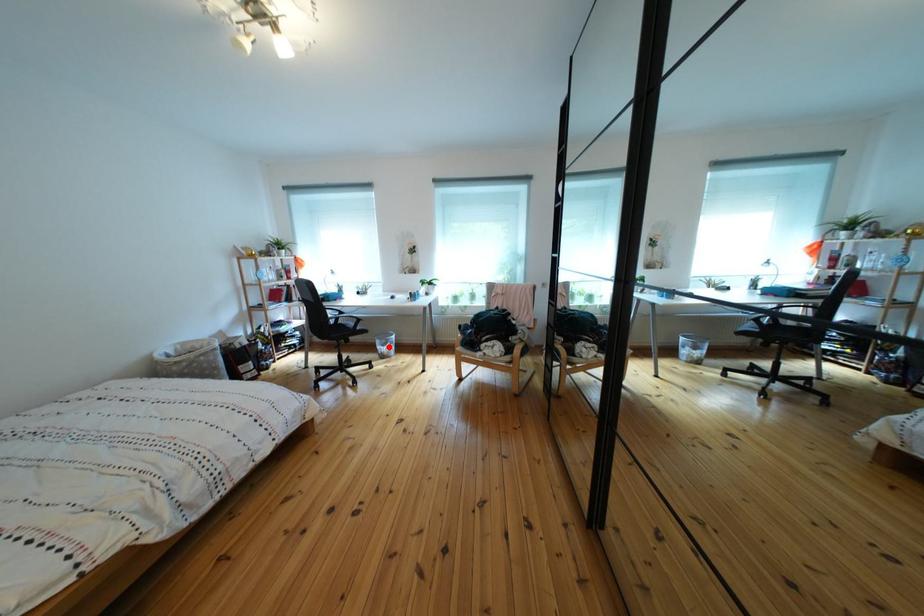
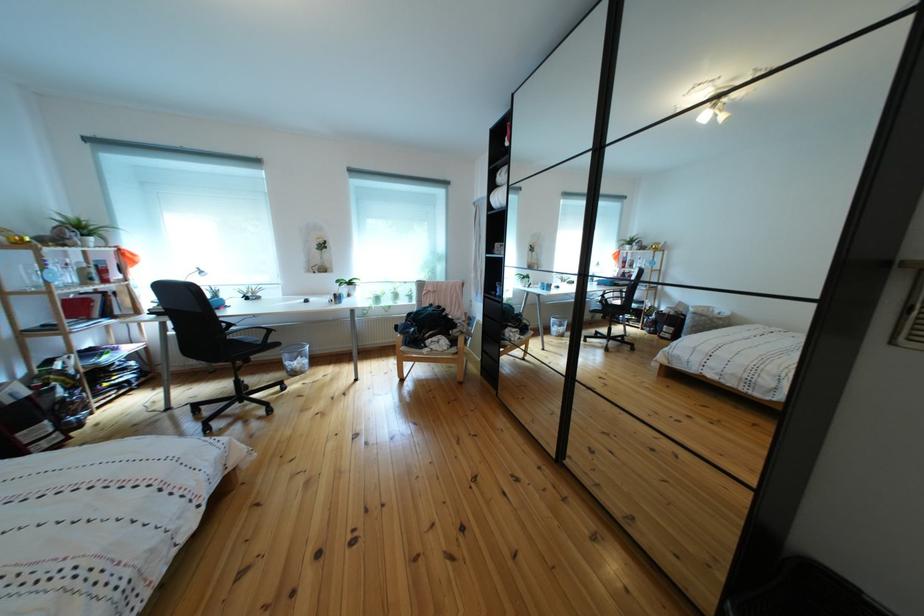
The point at the highlighted location is marked in the first image. Where is the corresponding point in the second image?

(297, 362)